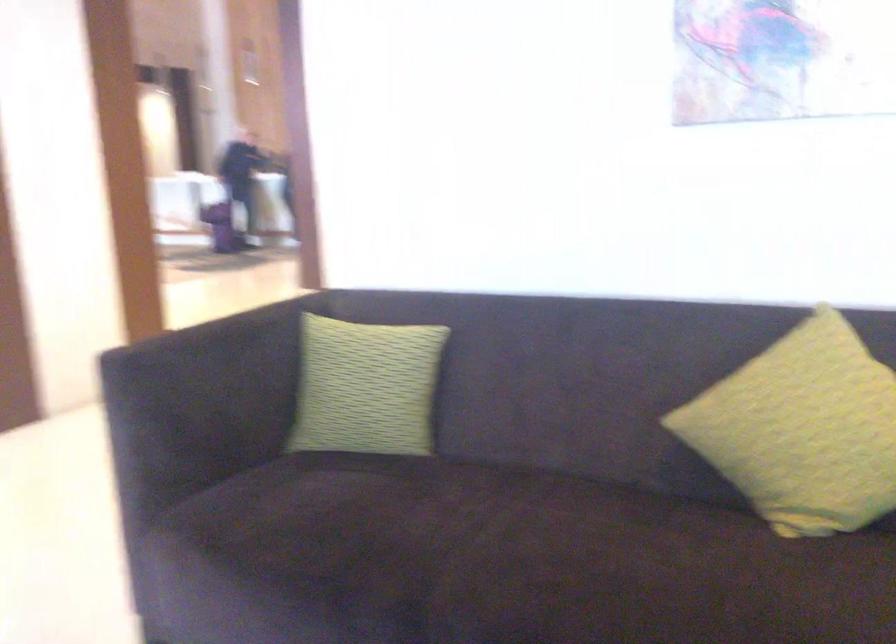
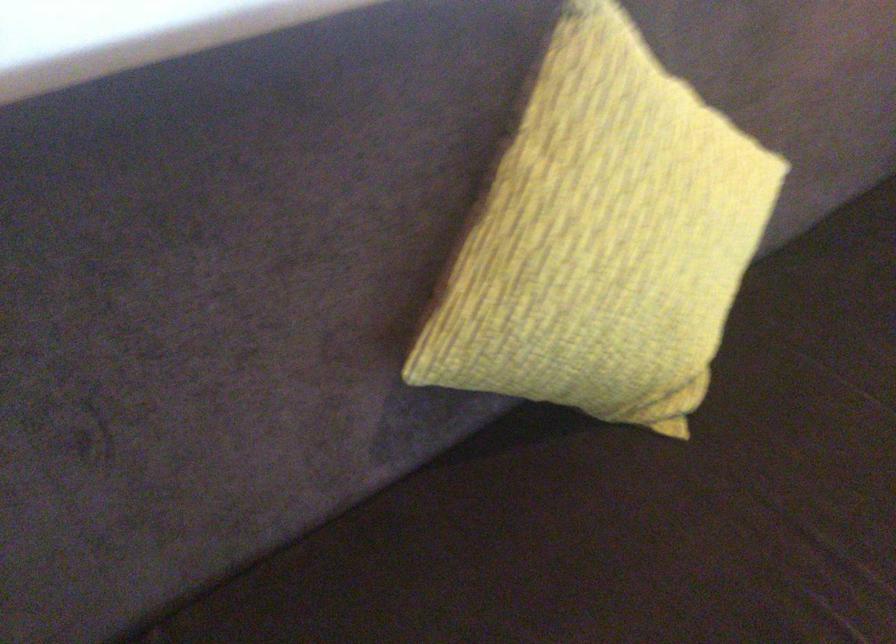
Locate, in the second image, the point that corresponds to (x=660, y=341) in the first image.

(231, 210)